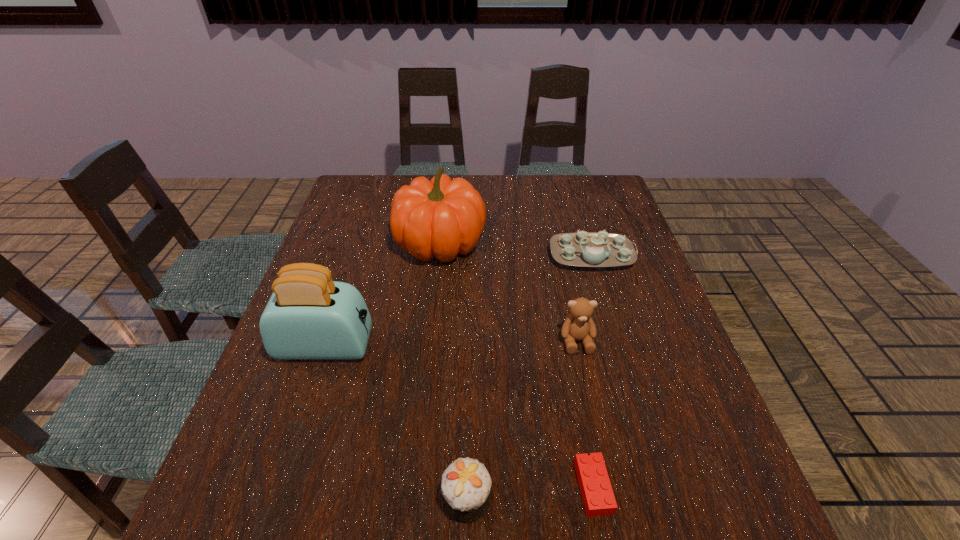
Where is `object that is the second closest to the shortest object`? This screenshot has width=960, height=540. object that is the second closest to the shortest object is located at coordinates (578, 325).

Where is `object that stands as the fourth closest to the cupcake`? object that stands as the fourth closest to the cupcake is located at coordinates (440, 218).

Identify the location of free space that satisfies the following two spatial constraints: 1. on the back side of the shortest object; 2. on the left side of the cupcake. This screenshot has width=960, height=540. (468, 487).

Find the location of a particular element. This screenshot has width=960, height=540. blank area in the image that satisfies the following two spatial constraints: 1. on the back side of the cupcake; 2. on the left side of the chinaware is located at coordinates (472, 255).